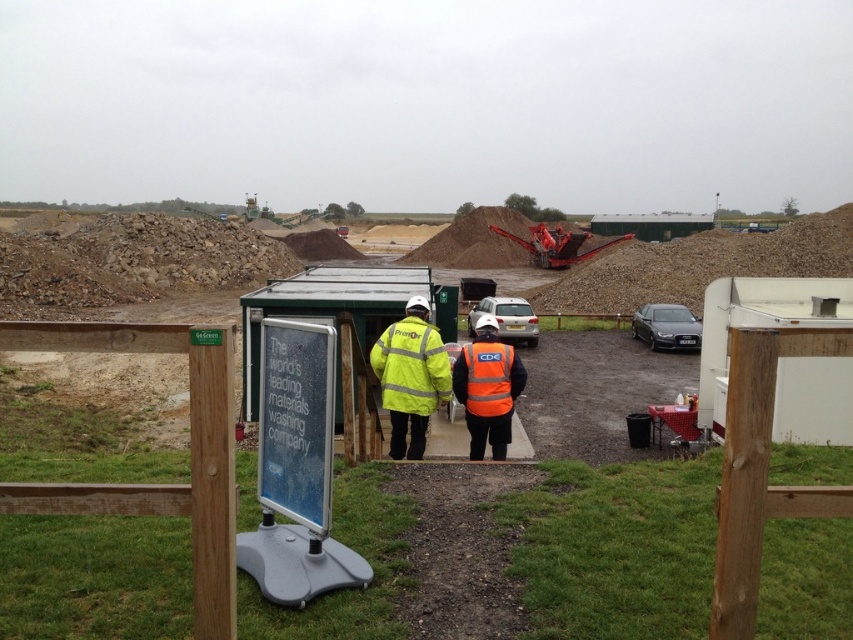
You are a safety inspector at the construction site. You need to ensure that the orange reflective vest at center and the reflective yellow vest at center are at least 2 meters apart for safety protocols. Are they compliant with the safety distance requirement?

The orange reflective vest at center is 3.06 meters away from the reflective yellow vest at center, which exceeds the 2 meters requirement. Therefore, they are compliant with the safety distance requirement.

You are a safety inspector at this construction site. You notice two workers wearing orange reflective vest at center and reflective yellow vest at center. Which worker is standing to the right of the other?

The orange reflective vest at center is positioned on the right side of reflective yellow vest at center, so the worker in the orange reflective vest at center is standing to the right of the reflective yellow vest at center.